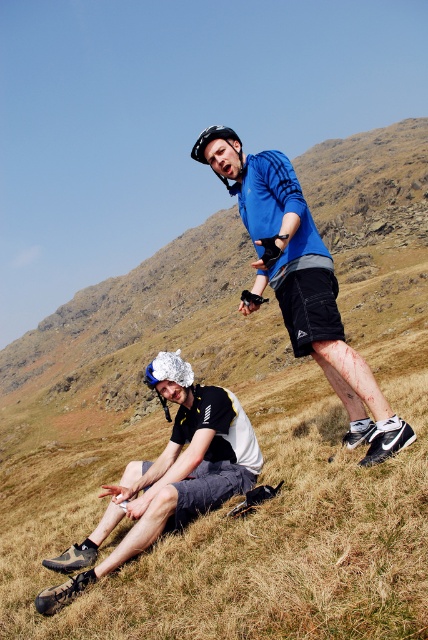
You are planning to take a photo of the blue synthetic jacket at upper center and the silver reflective helmet at center. Which object should you focus on first if you want to capture both in the same frame without moving the camera?

The blue synthetic jacket at upper center is much taller than the silver reflective helmet at center, so you should focus on the blue synthetic jacket at upper center first to ensure it fits within the frame.

You are a hiker who has just reached the summit and wants to place your blue synthetic jacket at upper center on the ground. Given that the ground at the summit is rocky and uneven, can you determine if the jacket will remain stable when placed there?

The blue synthetic jacket at upper center is located at point (306, 291) in the image, but the stability of the jacket on the rocky ground cannot be determined solely from its 2D coordinates. The actual terrain conditions at that location must be assessed for stability.

You are a hiker trying to decide which item to pack first for your trip. Based on the scene, which item, the blue synthetic jacket at upper center or the black mesh shorts at lower left, is taller and thus might require more packing space?

The blue synthetic jacket at upper center is taller than the black mesh shorts at lower left, so it might require more packing space.